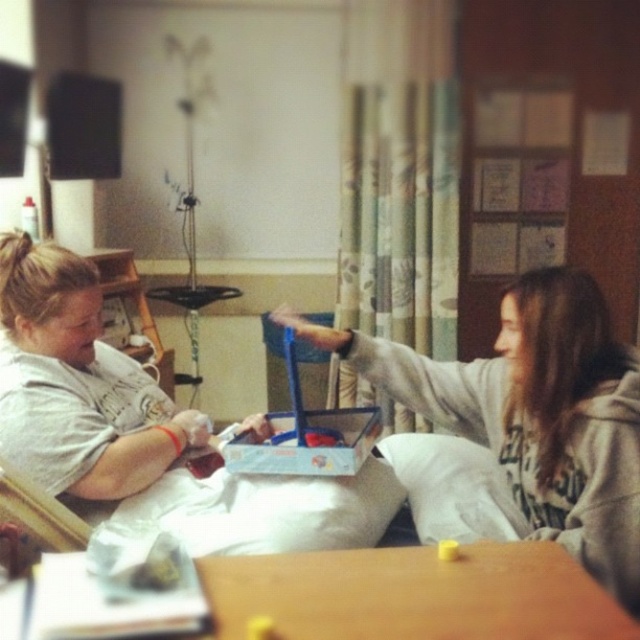
Can you confirm if gray fleece hoodie at upper right is positioned below wooden table at center?

No, gray fleece hoodie at upper right is not below wooden table at center.

Is gray fleece hoodie at upper right taller than wooden table at center?

Yes.

Locate an element on the screen. gray fleece hoodie at upper right is located at coordinates (536, 413).